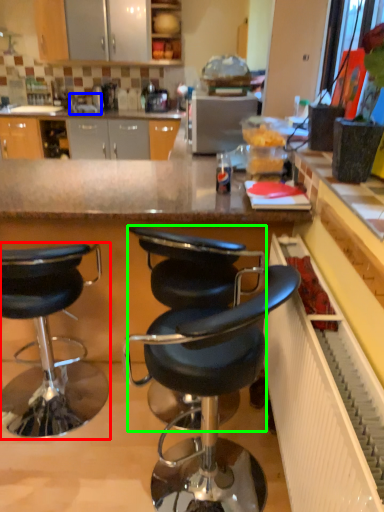
Question: Estimate the real-world distances between objects in this image. Which object is farther from chair (highlighted by a red box), sink (highlighted by a blue box) or chair (highlighted by a green box)?

Choices:
 (A) sink
 (B) chair

Answer: (A)